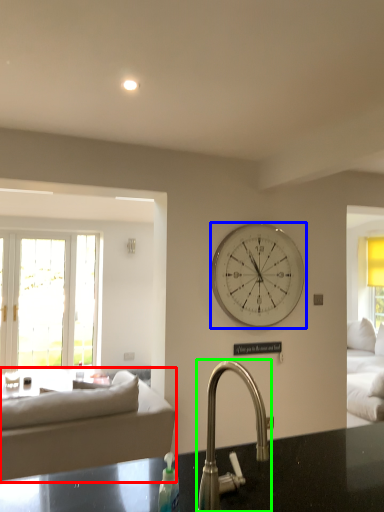
Question: Which is farther away from studio couch (highlighted by a red box)? wall clock (highlighted by a blue box) or tap (highlighted by a green box)?

Choices:
 (A) wall clock
 (B) tap

Answer: (B)